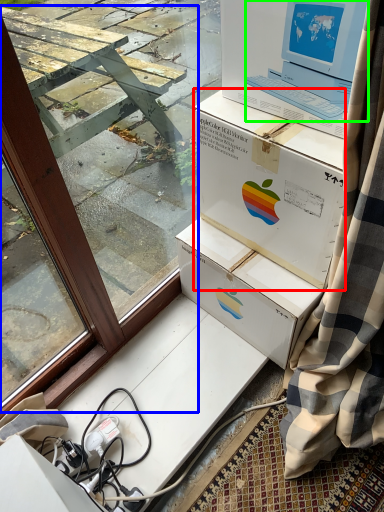
Question: Which is nearer to the box (highlighted by a red box)? window frame (highlighted by a blue box) or laptop (highlighted by a green box).

Choices:
 (A) window frame
 (B) laptop

Answer: (B)